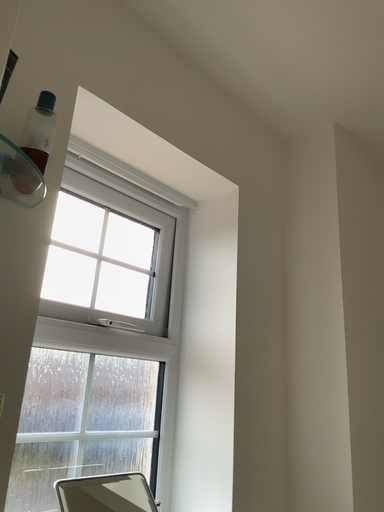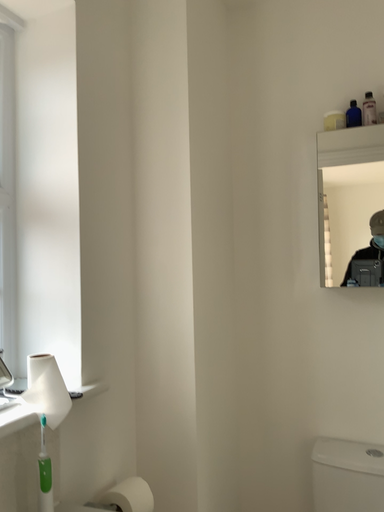
Question: How did the camera likely rotate when shooting the video?

Choices:
 (A) rotated left
 (B) rotated right

Answer: (B)